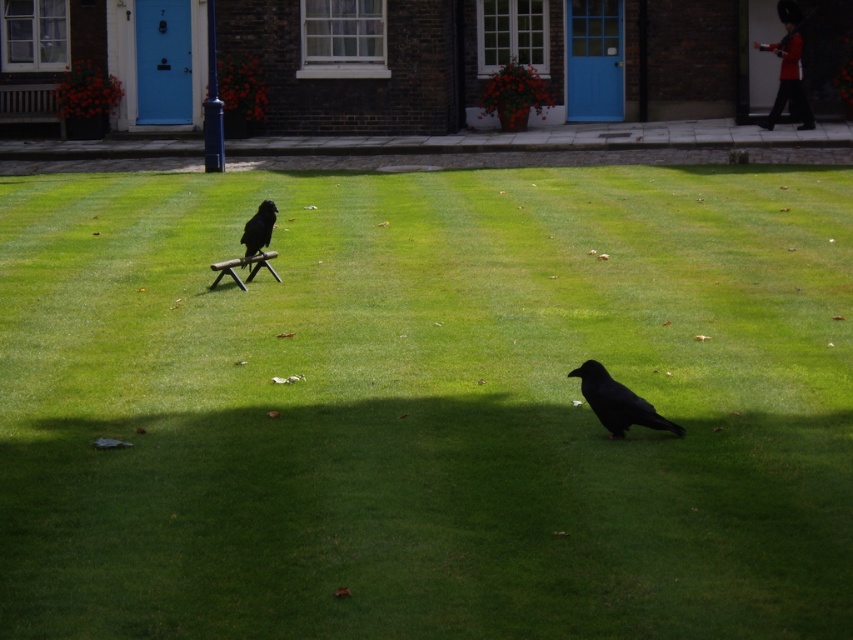
Question: Can you confirm if shiny black crow at lower right is smaller than black matte bird at center?

Choices:
 (A) no
 (B) yes

Answer: (A)

Question: Can you confirm if green grass at center is positioned to the left of shiny black crow at lower right?

Choices:
 (A) no
 (B) yes

Answer: (B)

Question: Which object appears closest to the camera in this image?

Choices:
 (A) green grass at center
 (B) shiny black crow at lower right

Answer: (A)

Question: Can you confirm if green grass at center is positioned below black matte bird at center?

Choices:
 (A) no
 (B) yes

Answer: (B)

Question: Which object is the closest to the green grass at center?

Choices:
 (A) shiny black crow at lower right
 (B) black matte bird at center

Answer: (A)

Question: Which point appears farthest from the camera in this image?

Choices:
 (A) (265, 230)
 (B) (585, 380)
 (C) (161, 560)

Answer: (A)